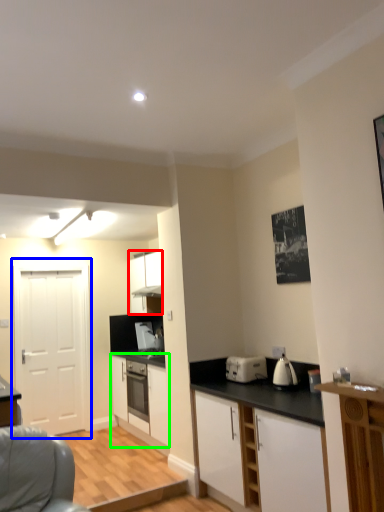
Question: Estimate the real-world distances between objects in this image. Which object is farther from cabinetry (highlighted by a red box), door (highlighted by a blue box) or cabinetry (highlighted by a green box)?

Choices:
 (A) door
 (B) cabinetry

Answer: (A)